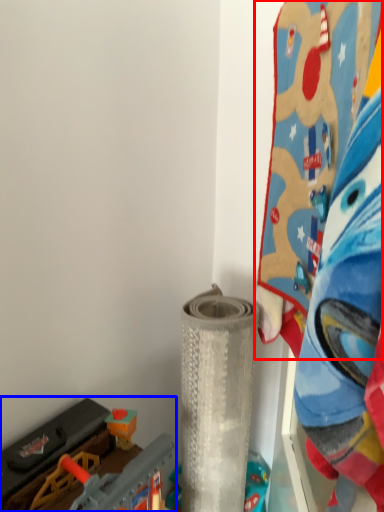
Question: Which point is further to the camera, toy (highlighted by a red box) or toy (highlighted by a blue box)?

Choices:
 (A) toy
 (B) toy

Answer: (B)